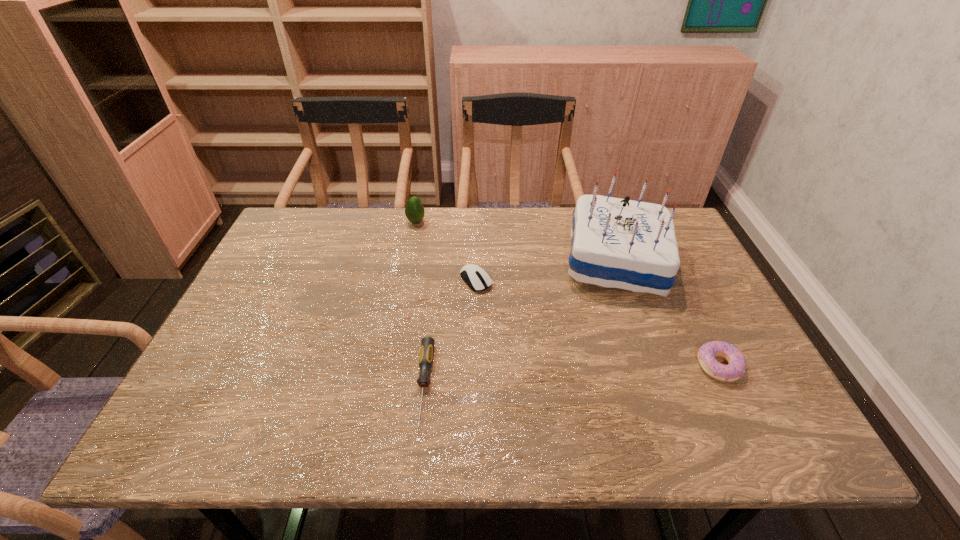
Locate an element on the screen. Image resolution: width=960 pixels, height=540 pixels. vacant space located 0.300m on the front of the mouse is located at coordinates (475, 390).

You are a GUI agent. You are given a task and a screenshot of the screen. Output one action in this format:
    pyautogui.click(x=<x>, y=<y>)
    Task: Click on the birthday cake that is at the far edge
    The width and height of the screenshot is (960, 540).
    Given the screenshot: What is the action you would take?
    pyautogui.click(x=616, y=243)

Where is `avocado located at the far edge`? The height and width of the screenshot is (540, 960). avocado located at the far edge is located at coordinates (414, 210).

At what (x,y) coordinates should I click in order to perform the action: click on object present at the near edge. Please return your answer as a coordinate pair (x, y). Looking at the image, I should click on (427, 344).

I want to click on birthday cake present at the right edge, so click(x=616, y=243).

Locate an element on the screen. Image resolution: width=960 pixels, height=540 pixels. doughnut situated at the right edge is located at coordinates (736, 368).

At what (x,y) coordinates should I click in order to perform the action: click on object present at the far right corner. Please return your answer as a coordinate pair (x, y). The image size is (960, 540). Looking at the image, I should click on (616, 243).

This screenshot has width=960, height=540. I want to click on vacant space at the far edge of the desktop, so click(527, 253).

This screenshot has height=540, width=960. Find the location of `vacant area at the left edge of the desktop`. vacant area at the left edge of the desktop is located at coordinates (246, 320).

Locate an element on the screen. free space at the right edge of the desktop is located at coordinates (721, 359).